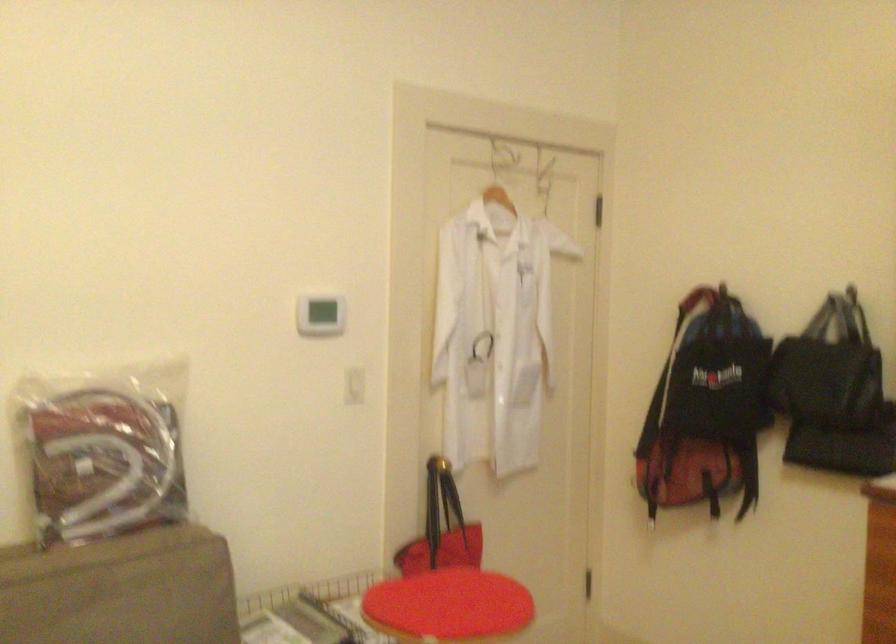
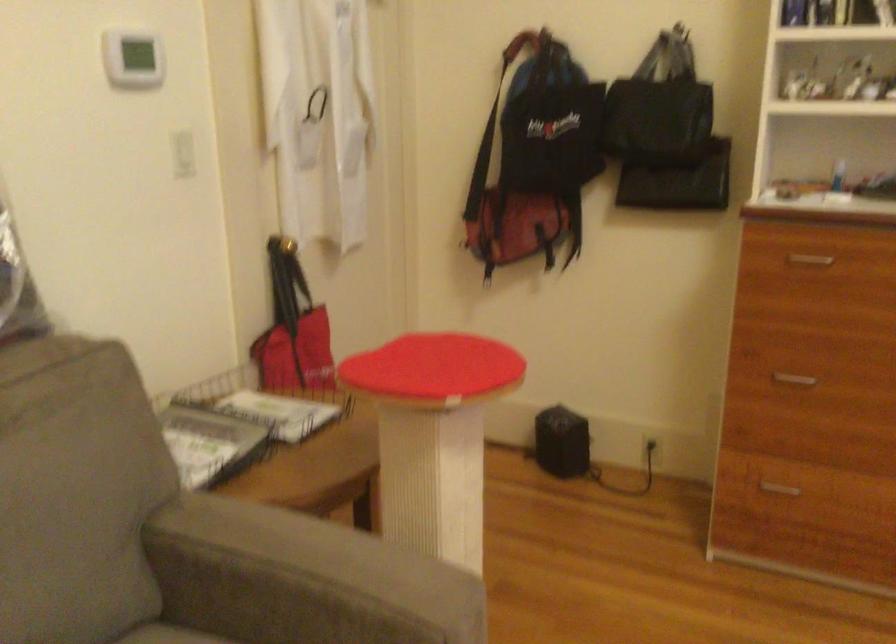
Question: The camera is either moving clockwise (left) or counter-clockwise (right) around the object. The first image is from the beginning of the video and the second image is from the end. Is the camera moving left or right when shooting the video?

Choices:
 (A) Left
 (B) Right

Answer: (A)